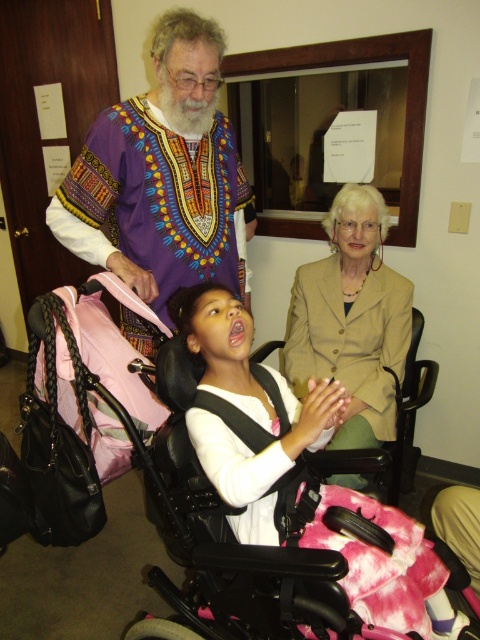
You are planning to place a small decorative item on the table in the scene. The item must be positioned exactly between the purple printed shirt at upper left and the young girl in the wheelchair. Can you determine if this placement is possible based on their current positions?

The purple printed shirt at upper left is located at point (160,173). Since the exact coordinates of the young girl in the wheelchair are not provided, it is impossible to determine the midpoint between them. Please provide the coordinates of the young girl in the wheelchair to proceed.